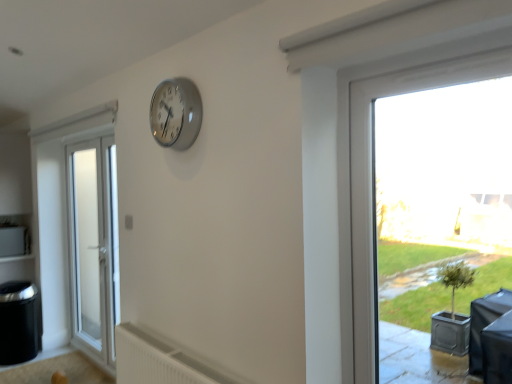
Question: Is transparent glass window at right next to white plastic radiator at lower center and touching it?

Choices:
 (A) yes
 (B) no

Answer: (B)

Question: Is transparent glass window at right thinner than white plastic radiator at lower center?

Choices:
 (A) no
 (B) yes

Answer: (B)

Question: Is white plastic radiator at lower center a part of transparent glass window at right?

Choices:
 (A) yes
 (B) no

Answer: (B)

Question: Is transparent glass window at right taller than white plastic radiator at lower center?

Choices:
 (A) no
 (B) yes

Answer: (B)

Question: From a real-world perspective, is transparent glass window at right below white plastic radiator at lower center?

Choices:
 (A) no
 (B) yes

Answer: (A)

Question: Considering the relative sizes of transparent glass window at right and white plastic radiator at lower center in the image provided, is transparent glass window at right smaller than white plastic radiator at lower center?

Choices:
 (A) yes
 (B) no

Answer: (A)

Question: Is the depth of white frosted glass door at left less than that of white plastic radiator at lower center?

Choices:
 (A) yes
 (B) no

Answer: (B)

Question: Is white plastic radiator at lower center at the back of white frosted glass door at left?

Choices:
 (A) yes
 (B) no

Answer: (B)

Question: Can you confirm if white frosted glass door at left is shorter than white plastic radiator at lower center?

Choices:
 (A) yes
 (B) no

Answer: (B)

Question: Is there a large distance between white frosted glass door at left and white plastic radiator at lower center?

Choices:
 (A) yes
 (B) no

Answer: (A)

Question: Considering the relative sizes of white frosted glass door at left and white plastic radiator at lower center in the image provided, is white frosted glass door at left thinner than white plastic radiator at lower center?

Choices:
 (A) no
 (B) yes

Answer: (A)

Question: Is white frosted glass door at left bigger than white plastic radiator at lower center?

Choices:
 (A) yes
 (B) no

Answer: (A)

Question: Is transparent glass window at right in front of silver metallic clock at upper center?

Choices:
 (A) yes
 (B) no

Answer: (A)